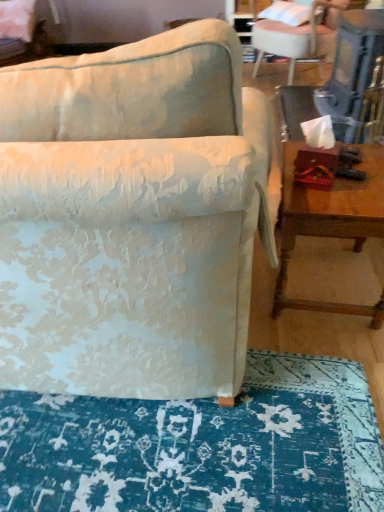
Question: Considering the positions of white fabric chair at upper right, arranged as the second chair when viewed from the left, and textured fabric chair at center, which ranks as the 2th chair in right-to-left order, in the image, is white fabric chair at upper right, arranged as the second chair when viewed from the left, taller or shorter than textured fabric chair at center, which ranks as the 2th chair in right-to-left order,?

Choices:
 (A) short
 (B) tall

Answer: (A)

Question: Is point (261, 54) positioned closer to the camera than point (14, 208)?

Choices:
 (A) closer
 (B) farther

Answer: (B)

Question: Estimate the real-world distances between objects in this image. Which object is closer to the white fabric pillow at upper right?

Choices:
 (A) textured fabric chair at center, the 2th chair in the top-to-bottom sequence
 (B) wooden table at right
 (C) blue textured rug at lower center
 (D) white fabric chair at upper right, marked as the second chair in a bottom-to-top arrangement

Answer: (D)

Question: Which object is the closest to the white fabric pillow at upper right?

Choices:
 (A) white fabric chair at upper right, marked as the second chair in a bottom-to-top arrangement
 (B) blue textured rug at lower center
 (C) textured fabric chair at center, which is the second chair from back to front
 (D) wooden table at right

Answer: (A)